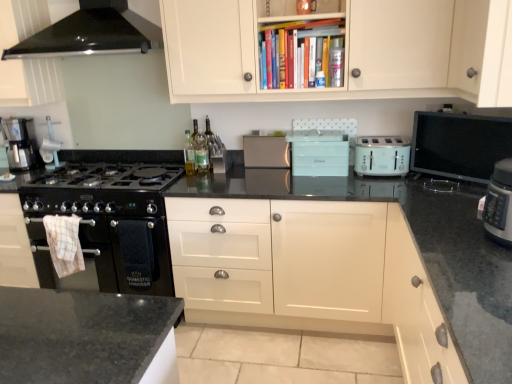
The height and width of the screenshot is (384, 512). I want to click on white matte cabinet at lower right, arranged as the 1th cabinetry when ordered from the bottom, so click(x=417, y=310).

Describe the element at coordinates (336, 63) in the screenshot. I see `translucent plastic bottle at upper center, the first bottle from the top` at that location.

Measure the distance between translucent glass bottle at center, which appears as the second bottle when viewed from the right, and camera.

They are 2.62 meters apart.

You are a GUI agent. You are given a task and a screenshot of the screen. Output one action in this format:
    pyautogui.click(x=<x>, y=<y>)
    Task: Click on the white matte cabinet at lower right, which ranks as the fourth cabinetry in top-to-bottom order
    The width and height of the screenshot is (512, 384).
    Given the screenshot: What is the action you would take?
    pyautogui.click(x=417, y=310)

From the image's perspective, is translucent glass bottle at center, marked as the 3th bottle in a top-to-bottom arrangement, positioned above or below black glass range hood at upper left?

translucent glass bottle at center, marked as the 3th bottle in a top-to-bottom arrangement, is below black glass range hood at upper left.

Can black glass range hood at upper left be found inside translucent glass bottle at center, marked as the 3th bottle in a top-to-bottom arrangement?

No, black glass range hood at upper left is located outside of translucent glass bottle at center, marked as the 3th bottle in a top-to-bottom arrangement.

Based on the photo, between translucent glass bottle at center, acting as the second bottle starting from the back, and black glass range hood at upper left, which one has smaller width?

translucent glass bottle at center, acting as the second bottle starting from the back, is thinner.

Considering the sizes of objects translucent glass bottle at center, which appears as the 1th bottle when ordered from the bottom, and black glass range hood at upper left in the image provided, who is bigger, translucent glass bottle at center, which appears as the 1th bottle when ordered from the bottom, or black glass range hood at upper left?

With larger size is black glass range hood at upper left.

Is point (129, 263) farther from camera compared to point (490, 99)?

Yes.

Is black matte oven at left placed right next to white matte cabinet door at upper right, which is the 3th cabinetry from bottom to top?

They are not placed beside each other.

From a real-world perspective, which is physically above, black matte oven at left or white matte cabinet door at upper right, which is the 3th cabinetry from bottom to top?

white matte cabinet door at upper right, which is the 3th cabinetry from bottom to top.

How far apart are mint green plastic toaster at center, which is the second appliance in right-to-left order, and white matte cabinet at upper center, arranged as the first cabinetry when viewed from the top?

mint green plastic toaster at center, which is the second appliance in right-to-left order, is 19.69 inches from white matte cabinet at upper center, arranged as the first cabinetry when viewed from the top.

From a real-world perspective, which object stands above the other?

From a 3D spatial view, white matte cabinet at upper center, arranged as the first cabinetry when viewed from the top, is above.

Does mint green plastic toaster at center, placed as the second appliance when sorted from left to right, turn towards white matte cabinet at upper center, arranged as the first cabinetry when viewed from the top?

No.

Is mint green plastic toaster at center, which is the second appliance in right-to-left order, with white matte cabinet at upper center, arranged as the first cabinetry when viewed from the top?

mint green plastic toaster at center, which is the second appliance in right-to-left order, and white matte cabinet at upper center, arranged as the first cabinetry when viewed from the top, are clearly separated.

In the scene shown: Is green glass bottle at center touching metallic silver coffee machine at left?

green glass bottle at center and metallic silver coffee machine at left are not in contact.

From the image's perspective, does green glass bottle at center appear lower than metallic silver coffee machine at left?

No, from the image's perspective, green glass bottle at center is not below metallic silver coffee machine at left.

Relative to metallic silver coffee machine at left, is green glass bottle at center in front or behind?

Clearly, green glass bottle at center is in front of metallic silver coffee machine at left.

The height and width of the screenshot is (384, 512). Identify the location of coffee machine behind the green glass bottle at center. (20, 143).

From the picture: Visually, is metallic silver coffee machine at left positioned to the left or to the right of translucent glass bottle at center, which appears as the 1th bottle when ordered from the bottom?

Based on their positions, metallic silver coffee machine at left is located to the left of translucent glass bottle at center, which appears as the 1th bottle when ordered from the bottom.

From the image's perspective, which object appears higher, metallic silver coffee machine at left or translucent glass bottle at center, which appears as the 1th bottle when ordered from the bottom?

metallic silver coffee machine at left.

How many degrees apart are the facing directions of metallic silver coffee machine at left and translucent glass bottle at center, which is counted as the 3th bottle, starting from the right?

The angular difference between metallic silver coffee machine at left and translucent glass bottle at center, which is counted as the 3th bottle, starting from the right, is 5.42 degrees.

Is metallic silver coffee machine at left not inside translucent glass bottle at center, the second bottle in the front-to-back sequence?

That's correct, metallic silver coffee machine at left is outside of translucent glass bottle at center, the second bottle in the front-to-back sequence.

Considering the relative sizes of translucent glass bottle at center, which is counted as the 3th bottle, starting from the right, and translucent glass bottle at center, which ranks as the second bottle in top-to-bottom order, in the image provided, is translucent glass bottle at center, which is counted as the 3th bottle, starting from the right, thinner than translucent glass bottle at center, which ranks as the second bottle in top-to-bottom order,?

Correct, the width of translucent glass bottle at center, which is counted as the 3th bottle, starting from the right, is less than that of translucent glass bottle at center, which ranks as the second bottle in top-to-bottom order.

Is translucent glass bottle at center, which is counted as the 3th bottle, starting from the right, inside or outside of translucent glass bottle at center, arranged as the second bottle when viewed from the left?

translucent glass bottle at center, which is counted as the 3th bottle, starting from the right, exists outside the volume of translucent glass bottle at center, arranged as the second bottle when viewed from the left.

Can you tell me how much translucent glass bottle at center, which appears as the 1th bottle when ordered from the bottom, and translucent glass bottle at center, the 1th bottle in the back-to-front sequence, differ in facing direction?

0.0033 degrees separate the facing orientations of translucent glass bottle at center, which appears as the 1th bottle when ordered from the bottom, and translucent glass bottle at center, the 1th bottle in the back-to-front sequence.

Which bottle is the 1st one when counting from the right side of the translucent glass bottle at center, the second bottle in the front-to-back sequence? Please provide its 2D coordinates.

[(201, 153)]

Does green glass bottle at center appear on the left side of black glass range hood at upper left?

No, green glass bottle at center is not to the left of black glass range hood at upper left.

Considering their positions, is green glass bottle at center located in front of or behind black glass range hood at upper left?

→ Clearly, green glass bottle at center is behind black glass range hood at upper left.

Where is `home appliance on the left of translucent glass bottle at center, which is the 1th bottle in left-to-right order`? The width and height of the screenshot is (512, 384). home appliance on the left of translucent glass bottle at center, which is the 1th bottle in left-to-right order is located at coordinates (92, 33).

Which cabinetry is the 4th one when counting from the right side of the black matte oven at left? Please provide its 2D coordinates.

[(482, 50)]

Looking at the image, which one is located closer to black granite countertop at center, black matte oven at left or mint green plastic toaster at center, placed as the second appliance when sorted from left to right?

mint green plastic toaster at center, placed as the second appliance when sorted from left to right, is positioned closer to the anchor black granite countertop at center.

Looking at the image, which one is located further to black granite countertop at center, translucent plastic bottle at upper center, the first bottle from the top, or green glass bottle at center?

Among the two, translucent plastic bottle at upper center, the first bottle from the top, is located further to black granite countertop at center.

Looking at the image, which one is located closer to white checkered towel at left, mint green plastic toaster at right or white matte cabinet at lower right, which ranks as the fourth cabinetry in top-to-bottom order?

Based on the image, mint green plastic toaster at right appears to be nearer to white checkered towel at left.

Which object lies further to the anchor point green glass bottle at center, translucent plastic bottle at upper center, placed as the third bottle when sorted from back to front, or white matte cabinet at lower right, arranged as the 1th cabinetry when ordered from the bottom?

white matte cabinet at lower right, arranged as the 1th cabinetry when ordered from the bottom, is further to green glass bottle at center.

From the image, which object appears to be nearer to mint green plastic toaster at center, which is the second appliance in right-to-left order, black matte oven at left or satin silver toaster at center, arranged as the 3th appliance when viewed from the right?

satin silver toaster at center, arranged as the 3th appliance when viewed from the right.

Consider the image. Considering their positions, is translucent plastic bottle at upper center, which is counted as the 3th bottle, starting from the left, positioned closer to translucent glass bottle at center, the third bottle positioned from the front, than mint green plastic toaster at right?

Among the two, translucent plastic bottle at upper center, which is counted as the 3th bottle, starting from the left, is located nearer to translucent glass bottle at center, the third bottle positioned from the front.

Considering their positions, is white matte cabinet at upper center, which appears as the 4th cabinetry when ordered from the bottom, positioned further to translucent glass bottle at center, which ranks as the second bottle in top-to-bottom order, than flat screen tv at right, the third appliance from the left?

flat screen tv at right, the third appliance from the left, is further to translucent glass bottle at center, which ranks as the second bottle in top-to-bottom order.

From the image, which object appears to be farther from translucent plastic bottle at upper center, acting as the 1th bottle starting from the front, black matte oven at left or white checkered towel at left?

white checkered towel at left lies further to translucent plastic bottle at upper center, acting as the 1th bottle starting from the front, than the other object.

Locate an element on the screen. Image resolution: width=512 pixels, height=384 pixels. kitchen appliance positioned between white matte cabinet at lower right, arranged as the 1th cabinetry when ordered from the bottom, and mint green plastic toaster at center, which is the second appliance in right-to-left order, from near to far is located at coordinates (381, 156).

Locate an element on the screen. The height and width of the screenshot is (384, 512). bottle between satin silver toaster at center, arranged as the 3th appliance when viewed from the right, and flat screen tv at right, the third appliance from the left is located at coordinates (336, 63).

You are a GUI agent. You are given a task and a screenshot of the screen. Output one action in this format:
    pyautogui.click(x=<x>, y=<y>)
    Task: Click on the wine bottle between translucent glass bottle at center, which appears as the second bottle when viewed from the right, and translucent plastic bottle at upper center, acting as the 1th bottle starting from the front, from left to right
    The width and height of the screenshot is (512, 384).
    Given the screenshot: What is the action you would take?
    pyautogui.click(x=211, y=139)

Locate an element on the screen. wine bottle located between metallic silver coffee machine at left and translucent plastic bottle at upper center, positioned as the third bottle in bottom-to-top order, in the left-right direction is located at coordinates (211, 139).